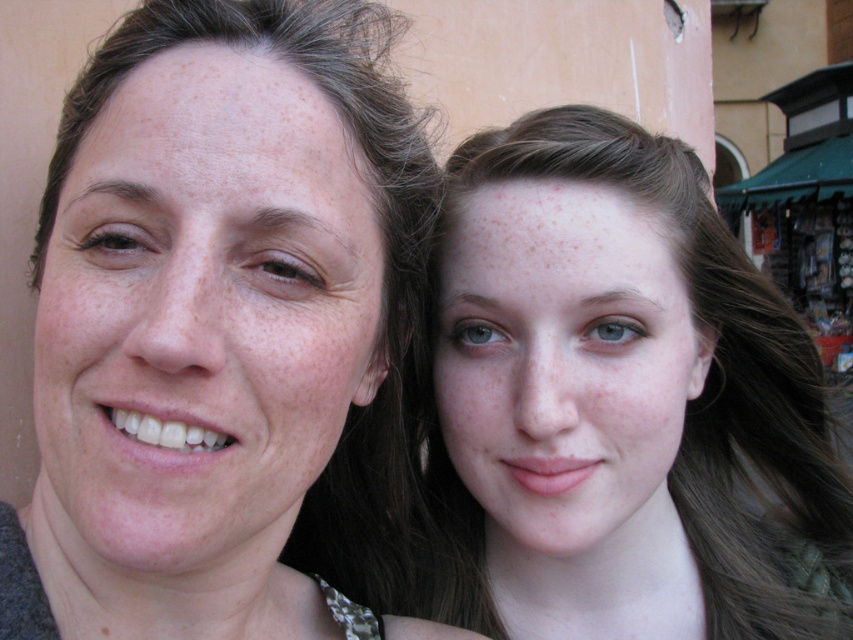
Is point (53, 536) positioned in front of point (677, 577)?

That is True.

Is matte skin at center smaller than smooth skin face at upper right?

Yes.

Is point (248, 257) closer to camera compared to point (566, 515)?

Yes, it is in front of point (566, 515).

Find the location of a particular element. Image resolution: width=853 pixels, height=640 pixels. matte skin at center is located at coordinates pos(223,330).